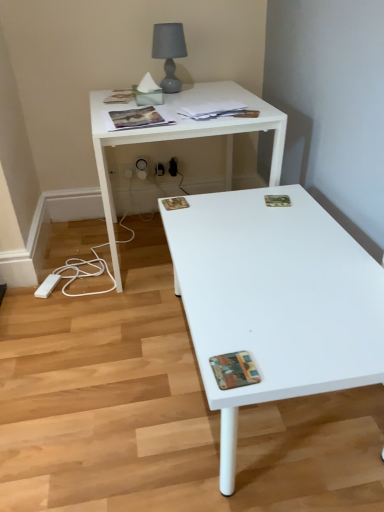
Identify the location of free space on the front side of white glossy desk at upper center. (113, 339).